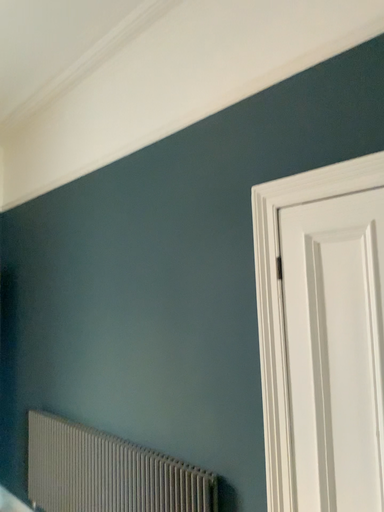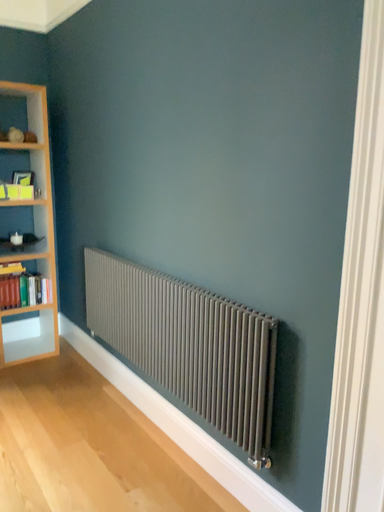
Question: Which way did the camera rotate in the video?

Choices:
 (A) rotated right
 (B) rotated left

Answer: (B)